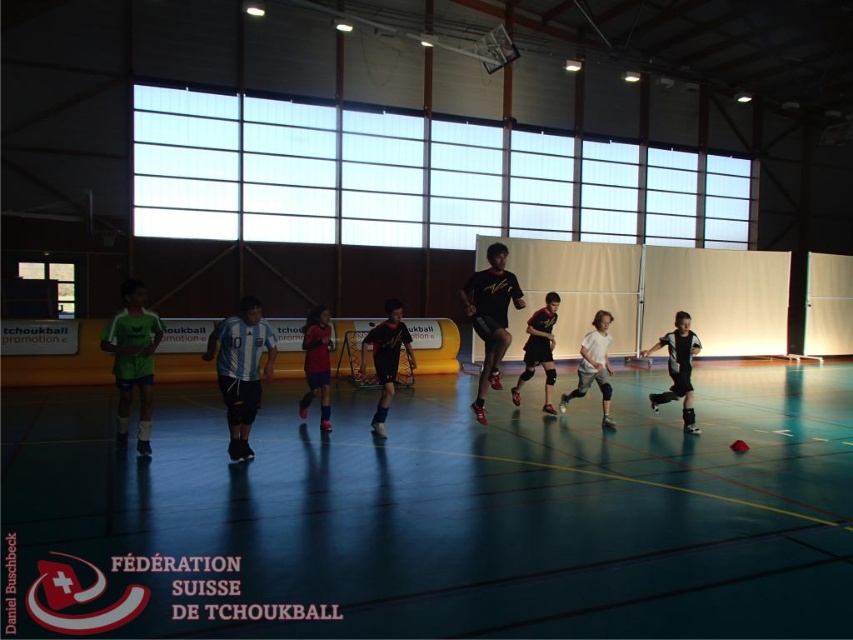
You are a gym teacher trying to set up a new game. You have a green rubber basketball court at center and a pair of matte black shorts at center. Which object is wider when viewed from above?

The green rubber basketball court at center is wider than matte black shorts at center.

You are a coach observing the game and need to identify players by their jersey colors. Which player, the black matte uniform at center or the matte red jersey at center, is closer to the ground?

The black matte uniform at center is shorter than the matte red jersey at center, so the black matte uniform at center is closer to the ground.